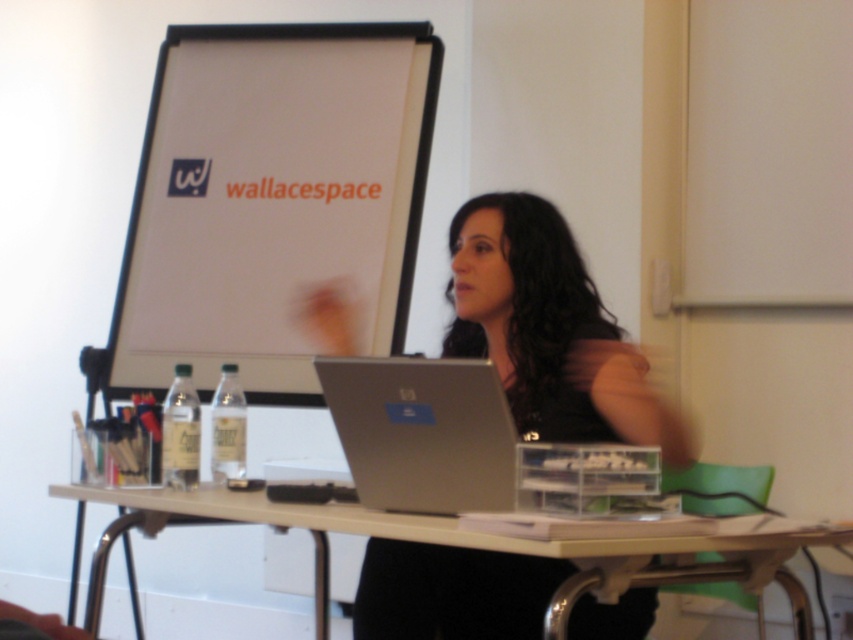
Who is positioned more to the right, white matte projection screen at upper left or silver metallic laptop at center?

From the viewer's perspective, silver metallic laptop at center appears more on the right side.

Between point (189, 106) and point (450, 448), which one is positioned in front?

Point (450, 448)

At what (x,y) coordinates should I click in order to perform the action: click on white matte projection screen at upper left. Please return your answer as a coordinate pair (x, y). This screenshot has height=640, width=853. Looking at the image, I should click on (271, 198).

In the scene shown: Does silver metallic laptop at center have a lesser height compared to white plastic table at center?

Yes, silver metallic laptop at center is shorter than white plastic table at center.

Locate an element on the screen. The height and width of the screenshot is (640, 853). silver metallic laptop at center is located at coordinates (463, 444).

Is point (451, 374) closer to camera compared to point (511, 540)?

That is False.

I want to click on silver metallic laptop at center, so click(x=463, y=444).

Who is more distant from viewer, (129, 236) or (636, 584)?

The point (129, 236) is more distant.

Is point (242, 90) positioned before point (279, 508)?

No, (242, 90) is behind (279, 508).

I want to click on white matte projection screen at upper left, so click(x=271, y=198).